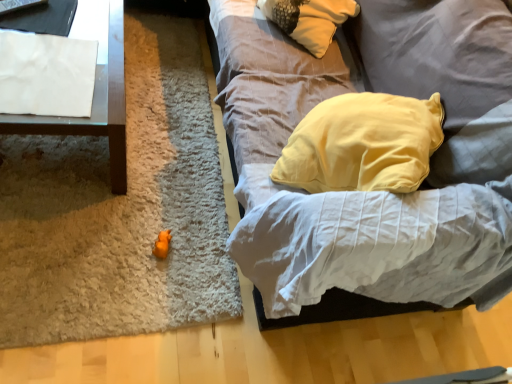
This screenshot has width=512, height=384. What are the coordinates of `vacant area that lies to the right of orange rubber duck at center` in the screenshot? It's located at (201, 264).